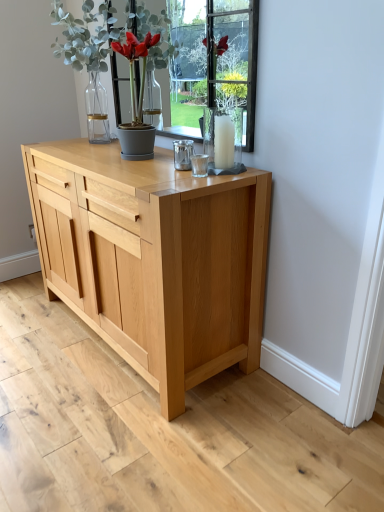
Identify the location of vacant region above natural wood chest of drawers at center (from a real-world perspective). (107, 159).